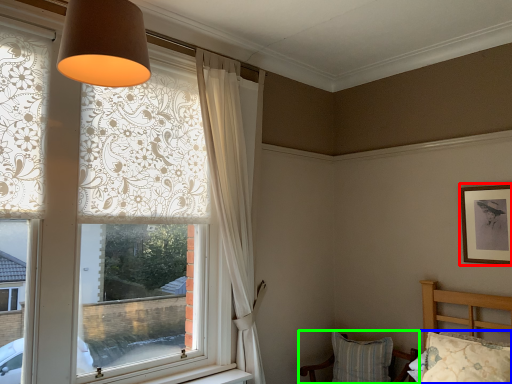
Question: Based on their relative distances, which object is nearer to picture frame (highlighted by a red box)? Choose from pillow (highlighted by a blue box) and chair (highlighted by a green box).

Choices:
 (A) pillow
 (B) chair

Answer: (A)